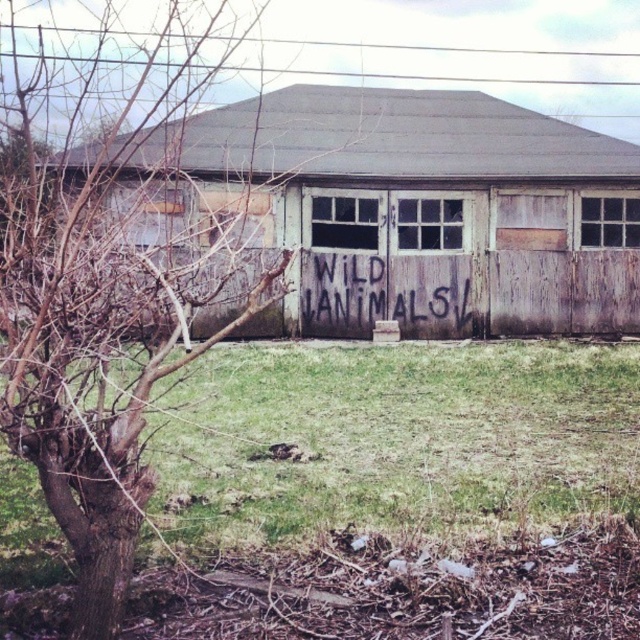
Which of these two, bare wood tree at left or green grass at lower center, stands shorter?

With less height is green grass at lower center.

Between bare wood tree at left and green grass at lower center, which one is positioned lower?

green grass at lower center is lower down.

Where is `bare wood tree at left`? Image resolution: width=640 pixels, height=640 pixels. bare wood tree at left is located at coordinates (106, 292).

Is weathered wood shed at center wider than green grass at lower center?

Indeed, weathered wood shed at center has a greater width compared to green grass at lower center.

Does point (604, 192) come closer to viewer compared to point (435, 417)?

No, it is behind (435, 417).

What do you see at coordinates (429, 211) in the screenshot? I see `weathered wood shed at center` at bounding box center [429, 211].

This screenshot has width=640, height=640. What are the coordinates of `weathered wood shed at center` in the screenshot? It's located at (429, 211).

Measure the distance from bare wood tree at left to grungy wood sign at center.

bare wood tree at left and grungy wood sign at center are 3.69 meters apart from each other.

Who is more forward, (x=136, y=477) or (x=365, y=307)?

Point (x=136, y=477) is in front.

At what (x,y) coordinates should I click in order to perform the action: click on bare wood tree at left. Please return your answer as a coordinate pair (x, y). This screenshot has width=640, height=640. Looking at the image, I should click on (106, 292).